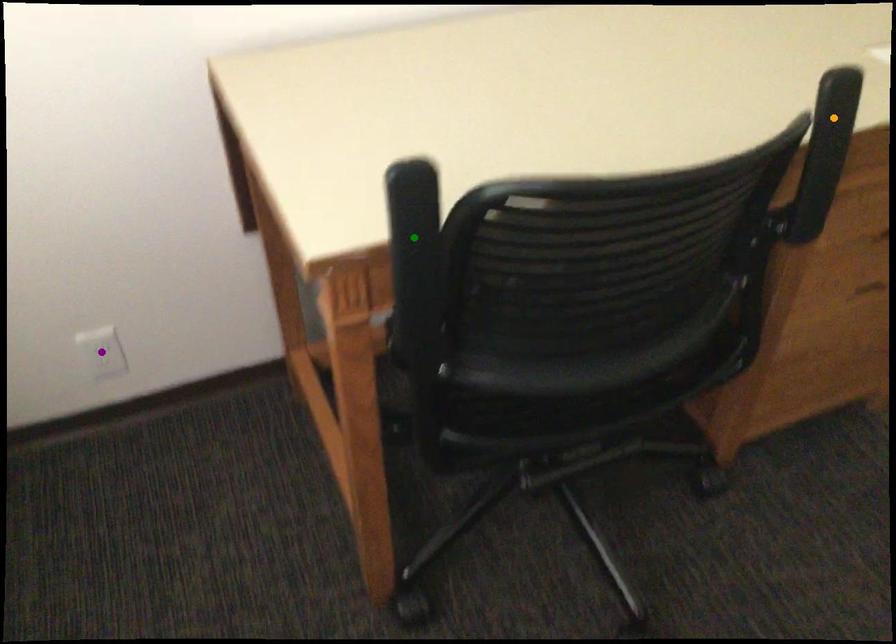
Order these from nearest to farthest:
orange point | purple point | green point

green point, orange point, purple point